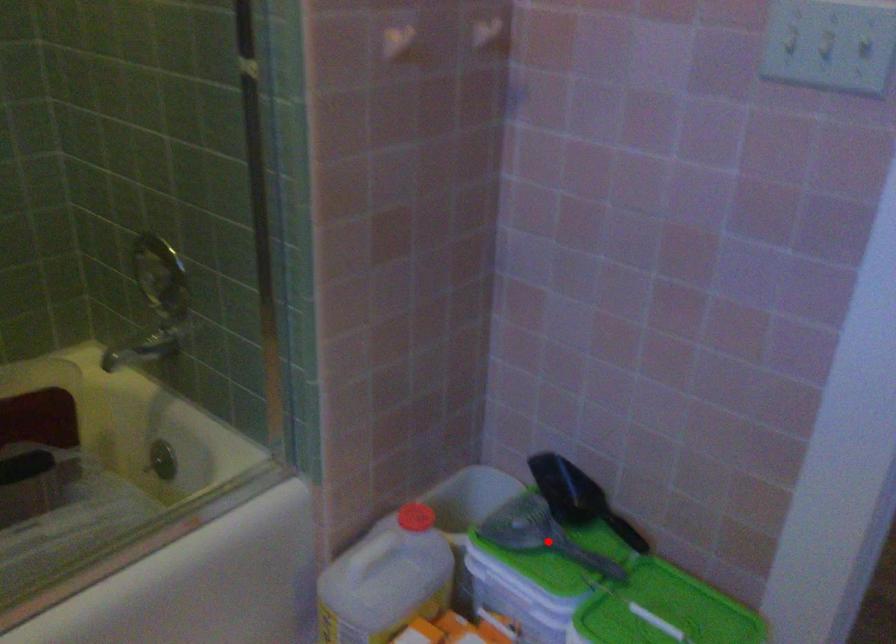
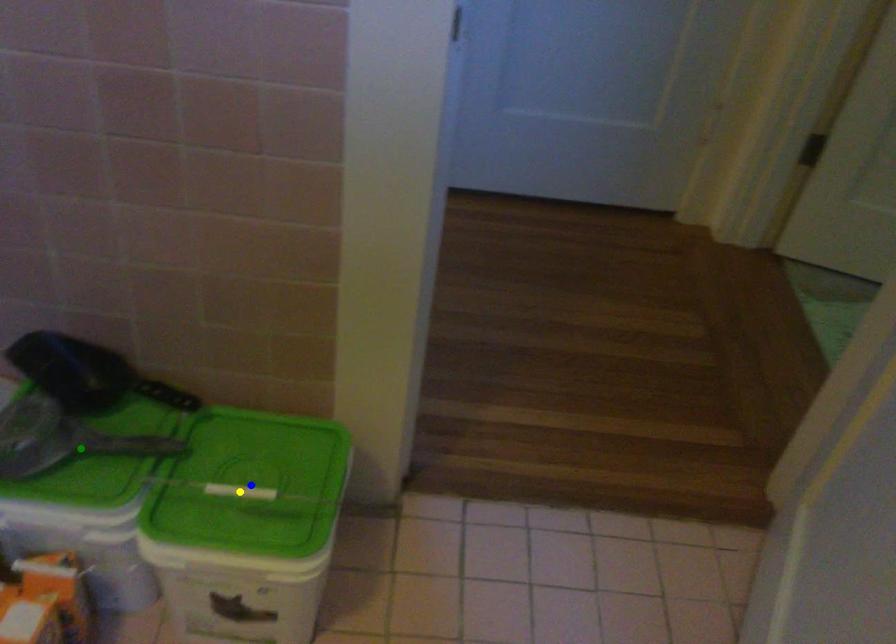
Question: I am providing you with two images of the same scene from different viewpoints. A red point is marked on the first image. You are given multiple points on the second image. Which mark in image 2 goes with the point in image 1?

Choices:
 (A) yellow point
 (B) blue point
 (C) green point

Answer: (C)